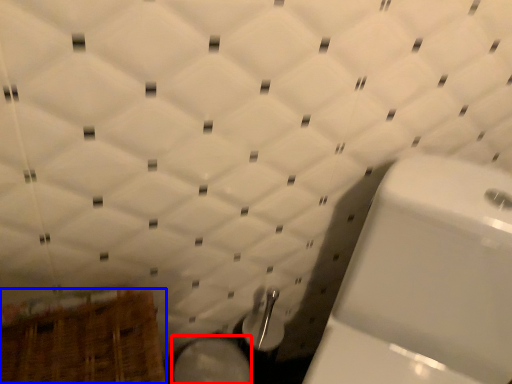
Question: Among these objects, which one is farthest to the camera, bidet (highlighted by a red box) or basket (highlighted by a blue box)?

Choices:
 (A) bidet
 (B) basket

Answer: (A)